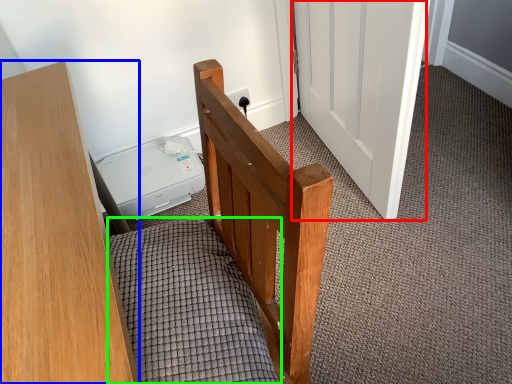
Question: Which object is the farthest from door (highlighted by a red box)? Choose among these: furniture (highlighted by a blue box) or bedding (highlighted by a green box).

Choices:
 (A) furniture
 (B) bedding

Answer: (A)